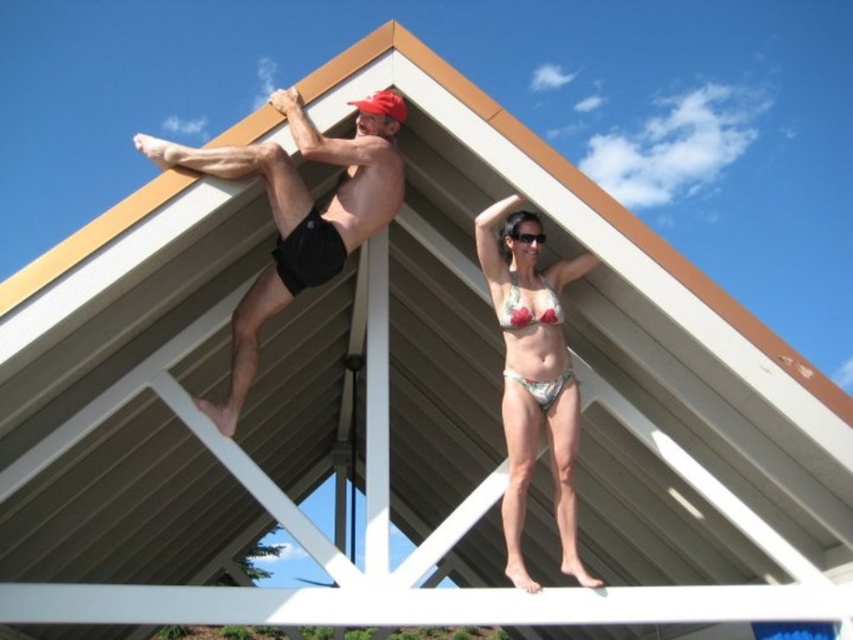
Question: Which point appears farthest from the camera in this image?

Choices:
 (A) (547, 284)
 (B) (555, 444)

Answer: (A)

Question: Does matte black shorts at upper center have a lesser width compared to floral bikini at upper right?

Choices:
 (A) no
 (B) yes

Answer: (A)

Question: Estimate the real-world distances between objects in this image. Which object is farther from the floral bikini at upper right?

Choices:
 (A) matte black shorts at upper center
 (B) transparent plastic goggles at upper center
 (C) printed fabric bikini top at upper center
 (D) matte black shorts at upper left

Answer: (A)

Question: Which point is farther to the camera?

Choices:
 (A) floral print fabric bikini at upper center
 (B) matte black shorts at upper left
 (C) printed fabric bikini top at upper center
 (D) floral bikini at upper right

Answer: (A)

Question: Can you confirm if matte black shorts at upper center is bigger than printed fabric bikini top at upper center?

Choices:
 (A) no
 (B) yes

Answer: (B)

Question: Can you confirm if matte black shorts at upper left is positioned above printed fabric bikini top at upper center?

Choices:
 (A) no
 (B) yes

Answer: (A)